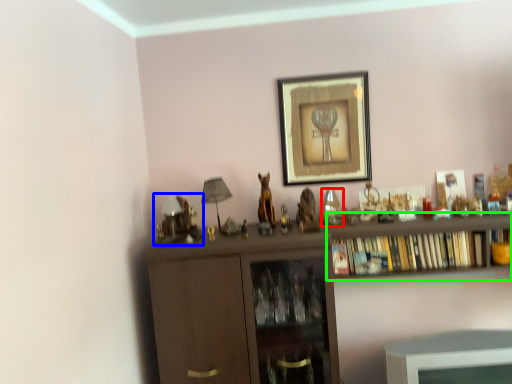
Question: Which object is the closest to the toy (highlighted by a red box)? Choose among these: toy (highlighted by a blue box) or shelf (highlighted by a green box).

Choices:
 (A) toy
 (B) shelf

Answer: (B)